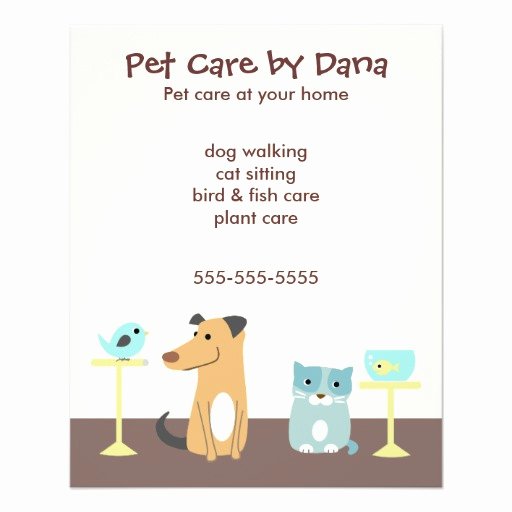
Where is `fish bowl`? The width and height of the screenshot is (512, 512). fish bowl is located at coordinates pos(408,358).